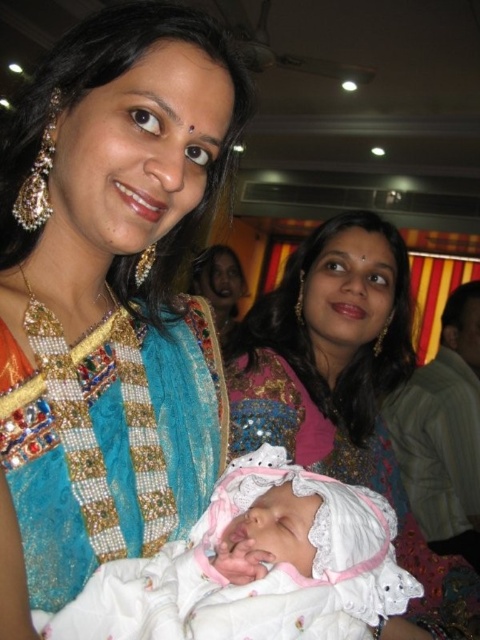
You are a photographer trying to capture a closeup shot of the woman on the left. You have two points marked in the image to focus on. The first point is at coordinate point [194,182] and the second is at point [225,296]. Which point should you choose to ensure the focus is on the woman closest to you?

Point [194,182] is closer to the viewer than point [225,296], so you should choose point [194,182] to focus on the woman closest to you.